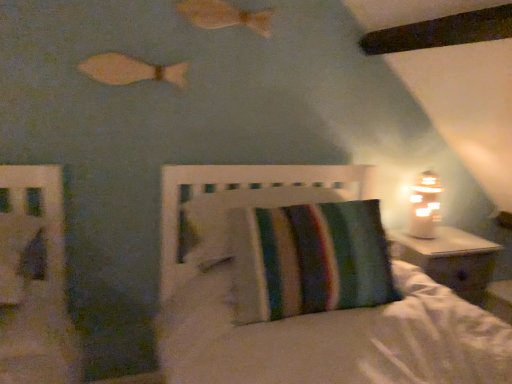
Question: Does wooden fish at upper center, positioned as the 2th fish in left-to-right order, have a lesser width compared to striped fabric headboard at center?

Choices:
 (A) yes
 (B) no

Answer: (A)

Question: Does wooden fish at upper center, positioned as the first fish in top-to-bottom order, lie in front of striped fabric headboard at center?

Choices:
 (A) no
 (B) yes

Answer: (A)

Question: Does wooden fish at upper center, the 1th fish when ordered from right to left, have a greater height compared to striped fabric headboard at center?

Choices:
 (A) no
 (B) yes

Answer: (A)

Question: From a real-world perspective, is wooden fish at upper center, the 2th fish from the bottom, below striped fabric headboard at center?

Choices:
 (A) no
 (B) yes

Answer: (A)

Question: Does wooden fish at upper center, positioned as the first fish in top-to-bottom order, have a larger size compared to striped fabric headboard at center?

Choices:
 (A) no
 (B) yes

Answer: (A)

Question: Is striped fabric pillow at center spatially inside wooden fish at upper center, positioned as the 2th fish in left-to-right order, or outside of it?

Choices:
 (A) inside
 (B) outside

Answer: (B)

Question: Is striped fabric pillow at center wider or thinner than wooden fish at upper center, the 1th fish when ordered from right to left?

Choices:
 (A) wide
 (B) thin

Answer: (A)

Question: Considering the relative positions of striped fabric pillow at center and wooden fish at upper center, the 2th fish from the bottom, in the image provided, is striped fabric pillow at center to the left or to the right of wooden fish at upper center, the 2th fish from the bottom,?

Choices:
 (A) left
 (B) right

Answer: (B)

Question: Is point (330, 312) positioned closer to the camera than point (198, 23)?

Choices:
 (A) farther
 (B) closer

Answer: (B)

Question: From the image's perspective, is striped fabric headboard at center above or below wooden fish at upper left, placed as the 2th fish when sorted from right to left?

Choices:
 (A) above
 (B) below

Answer: (B)

Question: Looking at the image, does striped fabric headboard at center seem bigger or smaller compared to wooden fish at upper left, placed as the 2th fish when sorted from right to left?

Choices:
 (A) big
 (B) small

Answer: (A)

Question: Would you say striped fabric headboard at center is to the left or to the right of wooden fish at upper left, positioned as the 1th fish in bottom-to-top order, in the picture?

Choices:
 (A) right
 (B) left

Answer: (A)

Question: Would you say striped fabric headboard at center is inside or outside wooden fish at upper left, the second fish viewed from the top?

Choices:
 (A) outside
 (B) inside

Answer: (A)

Question: Based on their sizes in the image, would you say white frosted glass table lamp at right is bigger or smaller than striped fabric headboard at center?

Choices:
 (A) big
 (B) small

Answer: (B)

Question: From their relative heights in the image, would you say white frosted glass table lamp at right is taller or shorter than striped fabric headboard at center?

Choices:
 (A) tall
 (B) short

Answer: (A)